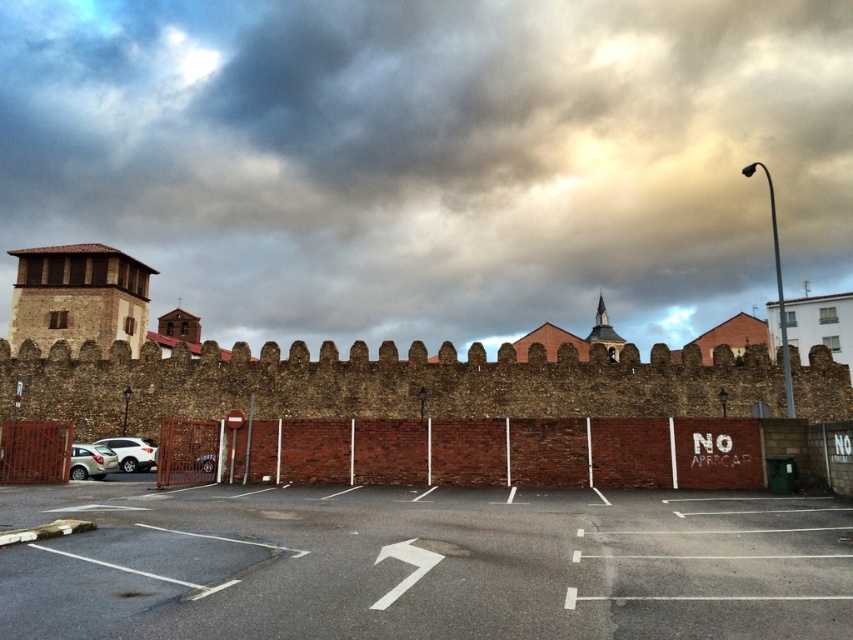
Question: Is brick wall at center positioned in front of satin silver car at lower left?

Choices:
 (A) yes
 (B) no

Answer: (A)

Question: Which point is closer to the camera taking this photo?

Choices:
 (A) (616, 621)
 (B) (59, 248)
 (C) (415, 32)
 (D) (76, 449)

Answer: (A)

Question: Is cloudy sky at upper center smaller than silver metallic hatchback at lower left?

Choices:
 (A) yes
 (B) no

Answer: (B)

Question: Which of these objects is positioned farthest from the satin silver car at lower left?

Choices:
 (A) silver metallic hatchback at lower left
 (B) gray asphalt parking lot at lower center
 (C) cloudy sky at upper center
 (D) brick wall at center

Answer: (C)

Question: Estimate the real-world distances between objects in this image. Which object is farther from the cloudy sky at upper center?

Choices:
 (A) brown stone tower at left
 (B) satin silver car at lower left
 (C) silver metallic hatchback at lower left
 (D) brick wall at center

Answer: (D)

Question: In this image, where is gray asphalt parking lot at lower center located relative to silver metallic hatchback at lower left?

Choices:
 (A) above
 (B) below

Answer: (A)